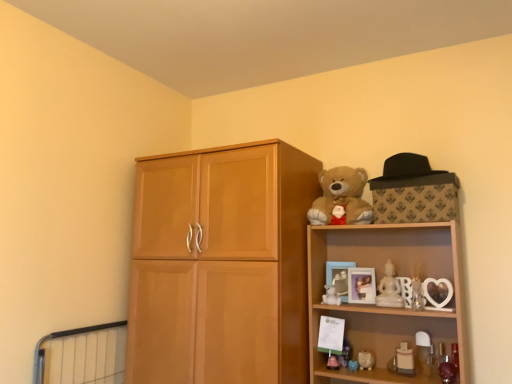
Question: Is black felt hat at upper right spatially inside soft plush teddy bear at upper right, or outside of it?

Choices:
 (A) outside
 (B) inside

Answer: (A)

Question: Based on their sizes in the image, would you say black felt hat at upper right is bigger or smaller than soft plush teddy bear at upper right?

Choices:
 (A) small
 (B) big

Answer: (A)

Question: Estimate the real-world distances between objects in this image. Which object is farther from the black felt hat at upper right?

Choices:
 (A) white glossy candle at lower right, the 2th toy when ordered from right to left
 (B) white glossy piggy bank at lower right, the second toy viewed from the left
 (C) wooden shelf at upper right
 (D) wooden picture frame at upper right, which appears as the 1th picture frame when viewed from the right
 (E) matte white picture frame at upper right, acting as the 1th picture frame starting from the left

Answer: (B)

Question: Considering the real-world distances, which object is closest to the white marble statue at upper center, the 3th toy viewed from the left?

Choices:
 (A) white glossy candle at lower right, the 2th toy when ordered from right to left
 (B) wooden picture frame at upper right, arranged as the 2th picture frame when viewed from the left
 (C) matte white picture frame at upper right, arranged as the 2th picture frame when viewed from the right
 (D) white glossy piggy bank at lower right, which is the fourth toy in right-to-left order
 (E) light brown wood cupboard at center

Answer: (B)